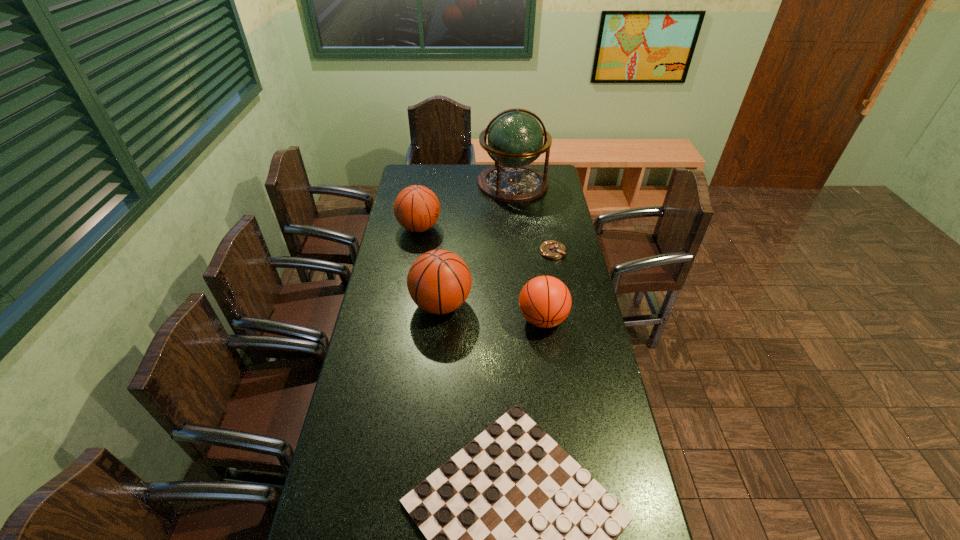
Locate an element on the screen. The image size is (960, 540). globe is located at coordinates (515, 139).

Where is `the tallest object`? The image size is (960, 540). the tallest object is located at coordinates (515, 139).

Find the location of a particular element. the fifth nearest object is located at coordinates (416, 208).

Identify the location of the rightmost basketball. (545, 301).

This screenshot has width=960, height=540. Identify the location of the fourth nearest object. (551, 249).

The image size is (960, 540). I want to click on vacant space located 0.110m on the front-facing side of the farthest object, so click(516, 217).

The width and height of the screenshot is (960, 540). I want to click on blank area located 0.150m on the back of the farthest basketball, so click(x=424, y=198).

Identify the location of blank area located 0.100m on the front of the rightmost basketball. (548, 362).

What are the coordinates of `vacant region located on the left of the third farthest object` in the screenshot? It's located at (467, 252).

You are a GUI agent. You are given a task and a screenshot of the screen. Output one action in this format:
    pyautogui.click(x=<x>, y=<y>)
    Task: Click on the object present at the far edge
    The image size is (960, 540).
    Given the screenshot: What is the action you would take?
    pyautogui.click(x=515, y=139)